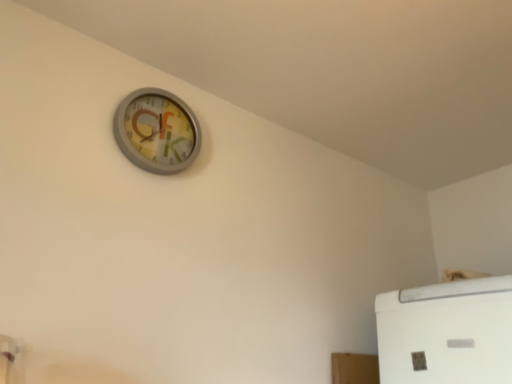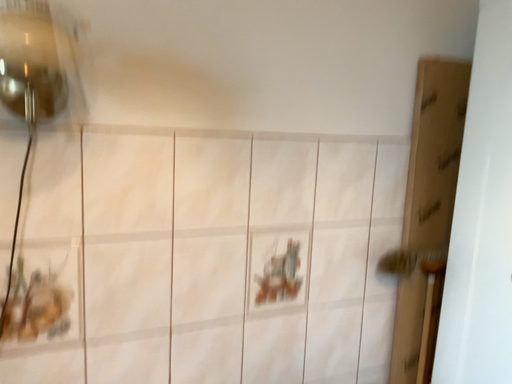
Question: How did the camera likely rotate when shooting the video?

Choices:
 (A) rotated upward
 (B) rotated downward

Answer: (B)